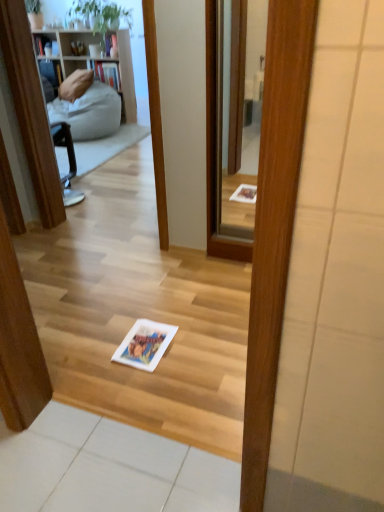
The height and width of the screenshot is (512, 384). Describe the element at coordinates (238, 109) in the screenshot. I see `clear glass mirror at center` at that location.

This screenshot has width=384, height=512. Find the location of `clear glass mirror at center`. clear glass mirror at center is located at coordinates pos(238,109).

Locate an element on the screen. The image size is (384, 512). white paper book at center is located at coordinates click(x=145, y=344).

This screenshot has height=512, width=384. What do you see at coordinates (145, 344) in the screenshot?
I see `white paper book at center` at bounding box center [145, 344].

Find the location of a particular element. clear glass mirror at center is located at coordinates (238, 109).

Considering the relative positions of clear glass mirror at center and white paper book at center in the image provided, is clear glass mirror at center to the left or to the right of white paper book at center?

clear glass mirror at center is to the right of white paper book at center.

Is the position of clear glass mirror at center more distant than that of white paper book at center?

Yes, the depth of clear glass mirror at center is greater than that of white paper book at center.

Is point (228, 195) farther from viewer compared to point (152, 358)?

Yes.

From the image's perspective, between clear glass mirror at center and white paper book at center, which one is located above?

clear glass mirror at center.

From a real-world perspective, is clear glass mirror at center positioned over white paper book at center based on gravity?

Indeed, from a real-world perspective, clear glass mirror at center stands above white paper book at center.

Is clear glass mirror at center thinner than white paper book at center?

Correct, the width of clear glass mirror at center is less than that of white paper book at center.

Which of these two, clear glass mirror at center or white paper book at center, stands taller?

Standing taller between the two is clear glass mirror at center.

Can you confirm if clear glass mirror at center is smaller than white paper book at center?

Actually, clear glass mirror at center might be larger than white paper book at center.

Can white paper book at center be found inside clear glass mirror at center?

That's incorrect, white paper book at center is not inside clear glass mirror at center.

Would you consider clear glass mirror at center to be distant from white paper book at center?

Yes, clear glass mirror at center is far from white paper book at center.

Is clear glass mirror at center facing away from white paper book at center?

clear glass mirror at center does not have its back to white paper book at center.

How many degrees apart are the facing directions of clear glass mirror at center and white paper book at center?

The facing directions of clear glass mirror at center and white paper book at center are 0.259 degrees apart.

What are the coordinates of `mirror located above the white paper book at center (from the image's perspective)` in the screenshot? It's located at (238, 109).

Is white paper book at center at the right side of clear glass mirror at center?

In fact, white paper book at center is to the left of clear glass mirror at center.

Is the depth of white paper book at center greater than that of clear glass mirror at center?

No, it is not.

Is point (129, 339) more distant than point (231, 133)?

No, it is not.

From the image's perspective, relative to clear glass mirror at center, is white paper book at center above or below?

white paper book at center is situated lower than clear glass mirror at center in the image.

From a real-world perspective, relative to clear glass mirror at center, is white paper book at center vertically above or below?

From a real-world perspective, white paper book at center is physically below clear glass mirror at center.

Is white paper book at center thinner than clear glass mirror at center?

No, white paper book at center is not thinner than clear glass mirror at center.

From their relative heights in the image, would you say white paper book at center is taller or shorter than clear glass mirror at center?

Considering their sizes, white paper book at center has less height than clear glass mirror at center.

Which of these two, white paper book at center or clear glass mirror at center, is bigger?

clear glass mirror at center is bigger.

Based on the photo, choose the correct answer: Is white paper book at center inside clear glass mirror at center or outside it?

white paper book at center is outside clear glass mirror at center.

Is white paper book at center beside clear glass mirror at center?

There is a gap between white paper book at center and clear glass mirror at center.

Is white paper book at center facing towards clear glass mirror at center?

No, white paper book at center does not turn towards clear glass mirror at center.

Measure the distance from white paper book at center to clear glass mirror at center.

A distance of 5.27 feet exists between white paper book at center and clear glass mirror at center.

Where is `book below the clear glass mirror at center (from the image's perspective)`? book below the clear glass mirror at center (from the image's perspective) is located at coordinates (145, 344).

Identify the location of book directly beneath the clear glass mirror at center (from a real-world perspective). click(145, 344).

The width and height of the screenshot is (384, 512). I want to click on mirror behind the white paper book at center, so click(x=238, y=109).